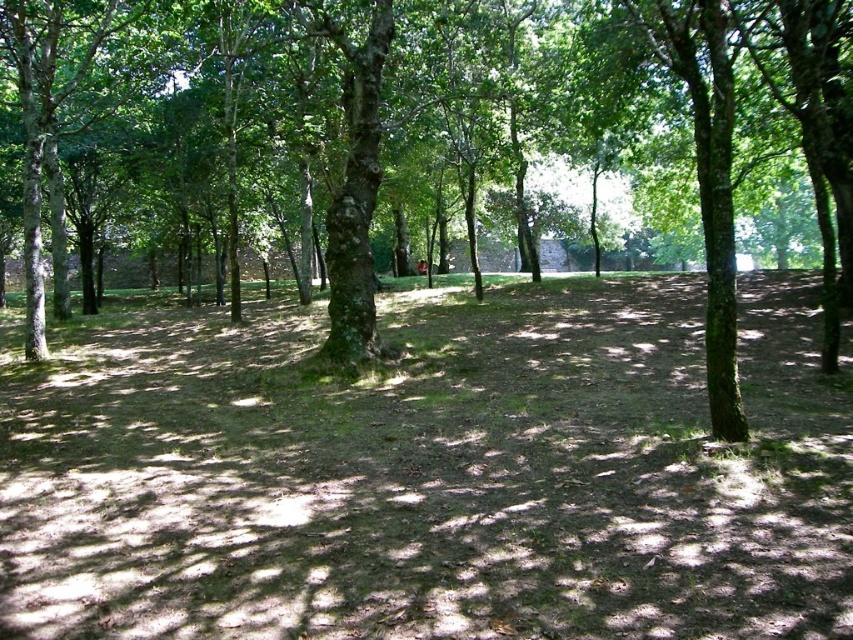
Question: Which point appears closest to the camera in this image?

Choices:
 (A) (149, 148)
 (B) (485, 388)

Answer: (B)

Question: Which point is closer to the camera taking this photo?

Choices:
 (A) (299, 141)
 (B) (605, 289)

Answer: (A)

Question: From the image, what is the correct spatial relationship of brown/dry soil at center in relation to green rough bark tree at center?

Choices:
 (A) below
 (B) above

Answer: (A)

Question: Is brown/dry soil at center below green rough bark tree at center?

Choices:
 (A) yes
 (B) no

Answer: (A)

Question: Does brown/dry soil at center have a greater width compared to green rough bark tree at center?

Choices:
 (A) no
 (B) yes

Answer: (A)